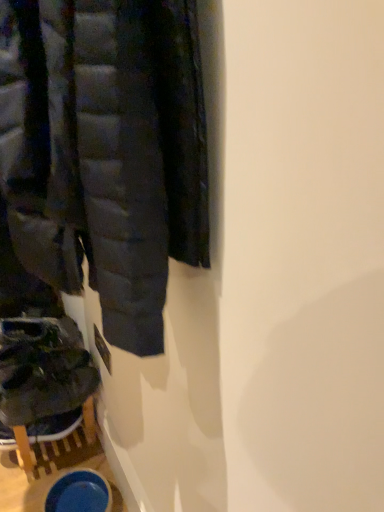
Locate an element on the screen. This screenshot has height=512, width=384. dark gray suede shoes at lower left is located at coordinates (x=43, y=369).

Describe the element at coordinates (43, 369) in the screenshot. This screenshot has height=512, width=384. I see `dark gray suede shoes at lower left` at that location.

Measure the distance between dark gray suede shoes at lower left and camera.

dark gray suede shoes at lower left and camera are 3.94 feet apart from each other.

What is the approximate height of matte black jacket at left?

matte black jacket at left is 20.20 inches tall.

What do you see at coordinates (105, 151) in the screenshot? This screenshot has width=384, height=512. I see `matte black jacket at left` at bounding box center [105, 151].

Measure the distance between matte black jacket at left and camera.

16.02 inches.

In order to face matte black jacket at left, should I rotate leftwards or rightwards?

It's best to rotate left around 19.009 degrees.

You are a GUI agent. You are given a task and a screenshot of the screen. Output one action in this format:
    pyautogui.click(x=<x>, y=<y>)
    Task: Click on the matte black jacket at left
    Image resolution: width=384 pixels, height=512 pixels.
    Given the screenshot: What is the action you would take?
    pyautogui.click(x=105, y=151)

The image size is (384, 512). What are the coordinates of `dark gray suede shoes at lower left` in the screenshot? It's located at (43, 369).

Which object is positioned more to the left, dark gray suede shoes at lower left or matte black jacket at left?

From the viewer's perspective, dark gray suede shoes at lower left appears more on the left side.

Considering their positions, is dark gray suede shoes at lower left located in front of or behind matte black jacket at left?

Clearly, dark gray suede shoes at lower left is behind matte black jacket at left.

Which is behind, point (17, 319) or point (205, 119)?

The point (17, 319) is farther from the camera.

From the image's perspective, is dark gray suede shoes at lower left located above or below matte black jacket at left?

dark gray suede shoes at lower left is below matte black jacket at left.

From a real-world perspective, is dark gray suede shoes at lower left over matte black jacket at left?

No, from a real-world perspective, dark gray suede shoes at lower left is not on top of matte black jacket at left.

Can you confirm if dark gray suede shoes at lower left is wider than matte black jacket at left?

Indeed, dark gray suede shoes at lower left has a greater width compared to matte black jacket at left.

Can you confirm if dark gray suede shoes at lower left is shorter than matte black jacket at left?

Yes, dark gray suede shoes at lower left is shorter than matte black jacket at left.

Considering the relative sizes of dark gray suede shoes at lower left and matte black jacket at left in the image provided, is dark gray suede shoes at lower left smaller than matte black jacket at left?

Indeed, dark gray suede shoes at lower left has a smaller size compared to matte black jacket at left.

Is dark gray suede shoes at lower left located outside matte black jacket at left?

Yes, dark gray suede shoes at lower left is located beyond the bounds of matte black jacket at left.

From the picture: Is dark gray suede shoes at lower left beside matte black jacket at left?

No, dark gray suede shoes at lower left is not next to matte black jacket at left.

Is dark gray suede shoes at lower left oriented towards matte black jacket at left?

No.

Can you tell me how much dark gray suede shoes at lower left and matte black jacket at left differ in facing direction?

6.92 degrees separate the facing orientations of dark gray suede shoes at lower left and matte black jacket at left.

Identify the location of footwear below the matte black jacket at left (from the image's perspective). (43, 369).

Between matte black jacket at left and dark gray suede shoes at lower left, which one appears on the left side from the viewer's perspective?

dark gray suede shoes at lower left.

Which object is further away from the camera, matte black jacket at left or dark gray suede shoes at lower left?

dark gray suede shoes at lower left is further away from the camera.

Does point (45, 174) lie behind point (43, 345)?

No, (45, 174) is in front of (43, 345).

From the image's perspective, relative to dark gray suede shoes at lower left, is matte black jacket at left above or below?

Clearly, from the image's perspective, matte black jacket at left is above dark gray suede shoes at lower left.

From a real-world perspective, which is physically above, matte black jacket at left or dark gray suede shoes at lower left?

matte black jacket at left, from a real-world perspective.

Can you confirm if matte black jacket at left is thinner than dark gray suede shoes at lower left?

Correct, the width of matte black jacket at left is less than that of dark gray suede shoes at lower left.

Which of these two, matte black jacket at left or dark gray suede shoes at lower left, stands shorter?

dark gray suede shoes at lower left is shorter.

Who is smaller, matte black jacket at left or dark gray suede shoes at lower left?

With smaller size is dark gray suede shoes at lower left.

Is matte black jacket at left outside of dark gray suede shoes at lower left?

Yes, matte black jacket at left is outside of dark gray suede shoes at lower left.

Is matte black jacket at left directly adjacent to dark gray suede shoes at lower left?

matte black jacket at left and dark gray suede shoes at lower left are clearly separated.

Could you tell me if matte black jacket at left is facing dark gray suede shoes at lower left?

No, matte black jacket at left is not oriented towards dark gray suede shoes at lower left.

Identify the location of jacket on the right of dark gray suede shoes at lower left. This screenshot has width=384, height=512. tap(105, 151).

What are the coordinates of `jacket that appears above the dark gray suede shoes at lower left (from the image's perspective)` in the screenshot? It's located at (105, 151).

The height and width of the screenshot is (512, 384). I want to click on footwear on the left of matte black jacket at left, so click(x=43, y=369).